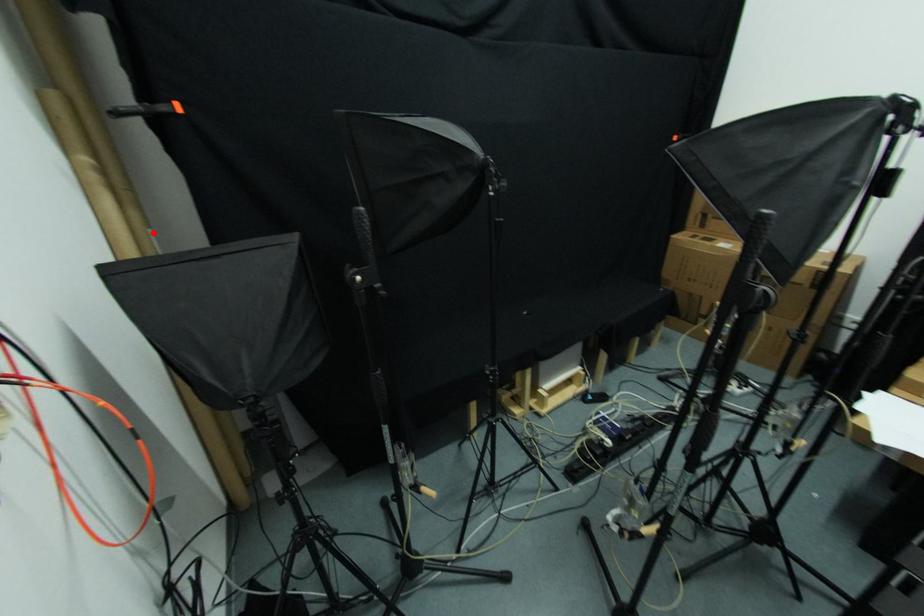
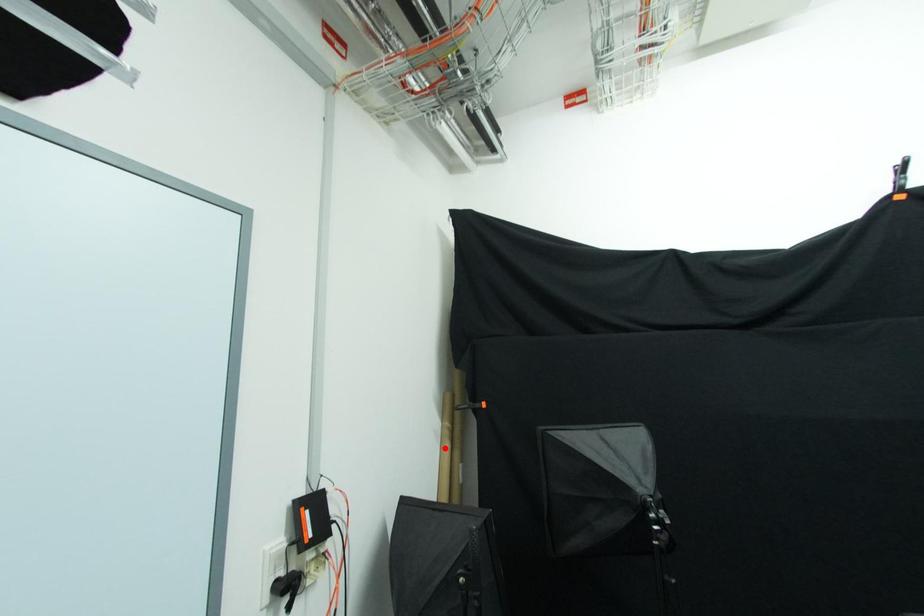
I am providing you with two images of the same scene from different viewpoints. A red point is marked on the first image and another point is marked on the second image. Does the point marked in image1 correspond to the same location as the one in image2?

No